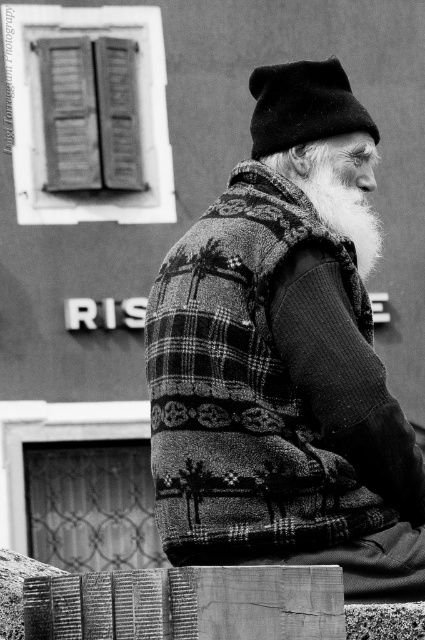
You are an artist sketching the elderly man in the scene. You notice the plaid wool vest at center and the white woolen beard at upper right. Which object is located lower in the image?

The plaid wool vest at center is positioned under the white woolen beard at upper right, so it is located lower in the image.

You are an artist sketching the elderly man in the scene. You need to decide which item, the plaid wool vest at center or the black woolen hat at upper center, you should sketch first based on their sizes. Which one should you start with?

The plaid wool vest at center has a greater height compared to the black woolen hat at upper center, so you should sketch the plaid wool vest at center first since it is larger in size.

You are an artist trying to sketch this scene. You want to place the black woolen hat at upper center in your drawing. Where exactly should you position it?

You should position the black woolen hat at upper center at point 0.166 along the horizontal axis and 0.713 along the vertical axis.